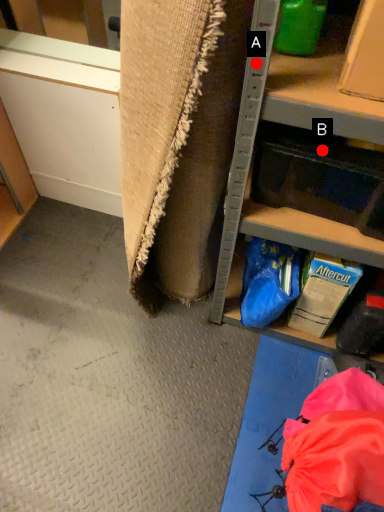
Question: Two points are circled on the image, labeled by A and B beside each circle. Which of the following is the closest to the observer?

Choices:
 (A) A is closer
 (B) B is closer

Answer: (A)